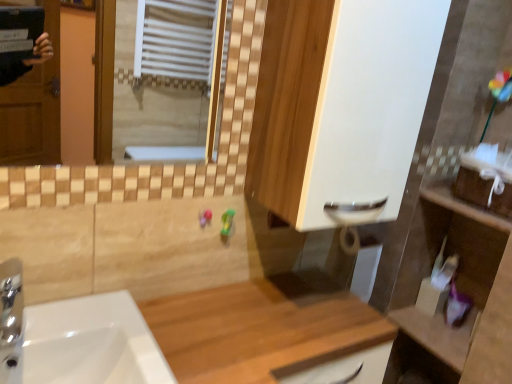
Question: Is white matte cabinet at center behind white glossy sink at lower left?

Choices:
 (A) yes
 (B) no

Answer: (A)

Question: Would you say white matte cabinet at center contains white glossy sink at lower left?

Choices:
 (A) yes
 (B) no

Answer: (B)

Question: Is white matte cabinet at center taller than white glossy sink at lower left?

Choices:
 (A) yes
 (B) no

Answer: (A)

Question: Is white matte cabinet at center turned away from white glossy sink at lower left?

Choices:
 (A) no
 (B) yes

Answer: (A)

Question: From the image's perspective, would you say white matte cabinet at center is shown under white glossy sink at lower left?

Choices:
 (A) no
 (B) yes

Answer: (A)

Question: Considering the relative sizes of white matte cabinet at center and white glossy sink at lower left in the image provided, is white matte cabinet at center thinner than white glossy sink at lower left?

Choices:
 (A) yes
 (B) no

Answer: (A)

Question: Is wooden at center aimed at chrome metallic tap at lower left?

Choices:
 (A) no
 (B) yes

Answer: (A)

Question: From the image's perspective, is wooden at center on chrome metallic tap at lower left?

Choices:
 (A) yes
 (B) no

Answer: (B)

Question: From a real-world perspective, is wooden at center under chrome metallic tap at lower left?

Choices:
 (A) no
 (B) yes

Answer: (B)

Question: Is wooden at center looking in the opposite direction of chrome metallic tap at lower left?

Choices:
 (A) no
 (B) yes

Answer: (A)

Question: Considering the relative sizes of wooden at center and chrome metallic tap at lower left in the image provided, is wooden at center wider than chrome metallic tap at lower left?

Choices:
 (A) no
 (B) yes

Answer: (B)

Question: Considering the relative positions of wooden at center and chrome metallic tap at lower left in the image provided, is wooden at center behind chrome metallic tap at lower left?

Choices:
 (A) yes
 (B) no

Answer: (B)

Question: From the image's perspective, is wooden at center located beneath white matte cabinet at center?

Choices:
 (A) yes
 (B) no

Answer: (A)